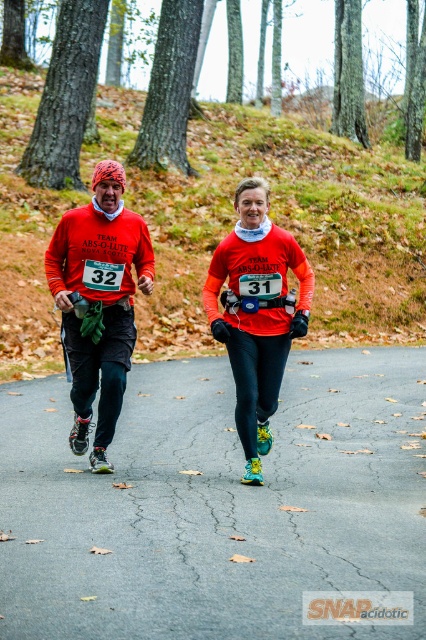
You are a photographer at the event who needs to capture both the green mossy hillside at upper center and the matte red shirt at center in a single shot. Given that your camera has a fixed focal length, which object should you focus on first to ensure both are in frame?

The green mossy hillside at upper center is larger than the matte red shirt at center, so focusing on the larger object first will help ensure both fit within the frame.

You are a photographer positioned at the finish line of the race. You want to capture both runners in a single shot. Given their positions at coordinates point (230, 429) and point (261, 330), which runner should you focus on first to ensure both are in frame?

Point (230, 429) is further to the viewer than point (261, 330). Therefore, focus on the runner at point (230, 429) first since they are closer to you, ensuring both remain in frame as you adjust the camera.